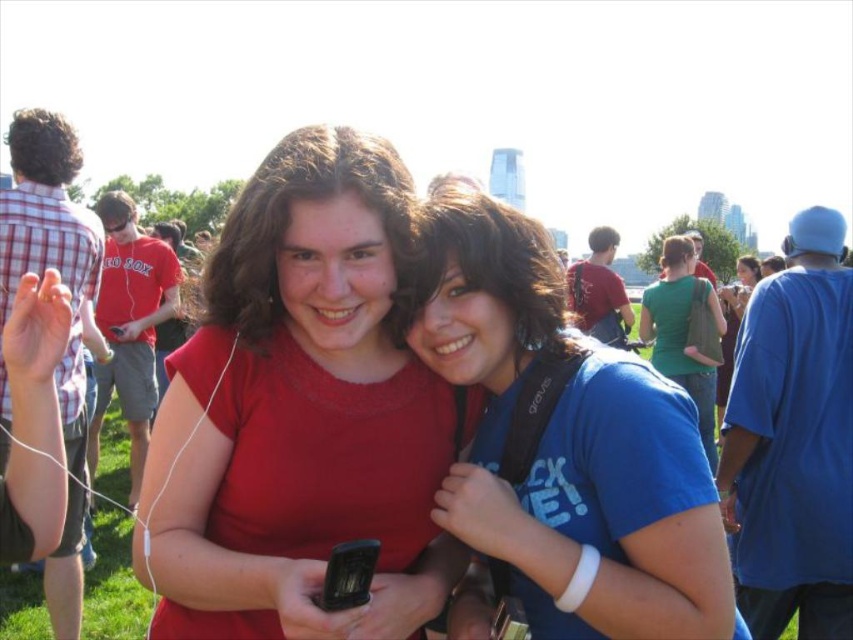
Based on the photo, can you confirm if matte red shirt at center is smaller than green matte shirt at center?

Actually, matte red shirt at center might be larger than green matte shirt at center.

Measure the distance between point (201, 381) and camera.

2010.40 feet

You are a GUI agent. You are given a task and a screenshot of the screen. Output one action in this format:
    pyautogui.click(x=<x>, y=<y>)
    Task: Click on the matte red shirt at center
    This screenshot has height=640, width=853.
    Given the screenshot: What is the action you would take?
    pyautogui.click(x=302, y=410)

Between matte red shirt at center and blue matte t-shirt at center, which one appears on the left side from the viewer's perspective?

Positioned to the left is matte red shirt at center.

Which is behind, point (265, 339) or point (694, 477)?

The point (265, 339) is more distant.

Where is `matte red shirt at center`? This screenshot has width=853, height=640. matte red shirt at center is located at coordinates (302, 410).

Does blue matte t-shirt at center come behind green matte shirt at center?

No, blue matte t-shirt at center is closer to the viewer.

Who is more forward, [535,566] or [679,289]?

Point [535,566] is more forward.

Locate an element on the screen. blue matte t-shirt at center is located at coordinates (567, 444).